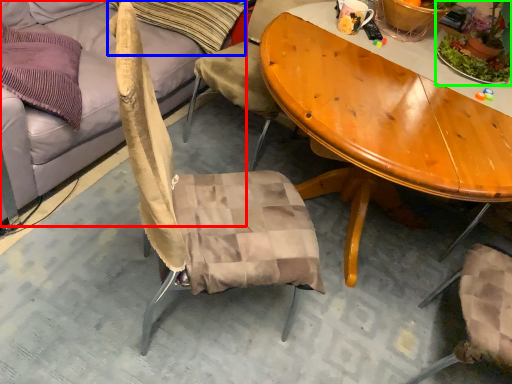
Question: Which is nearer to the studio couch (highlighted by a red box)? pillow (highlighted by a blue box) or houseplant (highlighted by a green box).

Choices:
 (A) pillow
 (B) houseplant

Answer: (A)